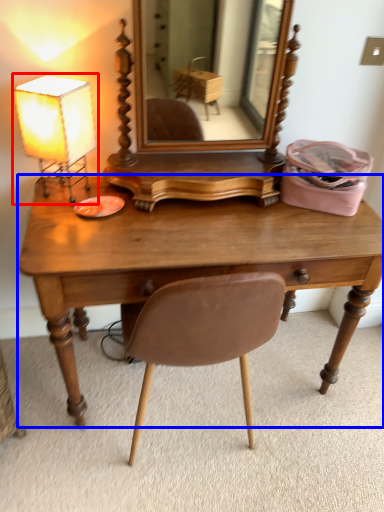
Question: Which point is closer to the camera, lamp (highlighted by a red box) or desk (highlighted by a blue box)?

Choices:
 (A) lamp
 (B) desk

Answer: (B)